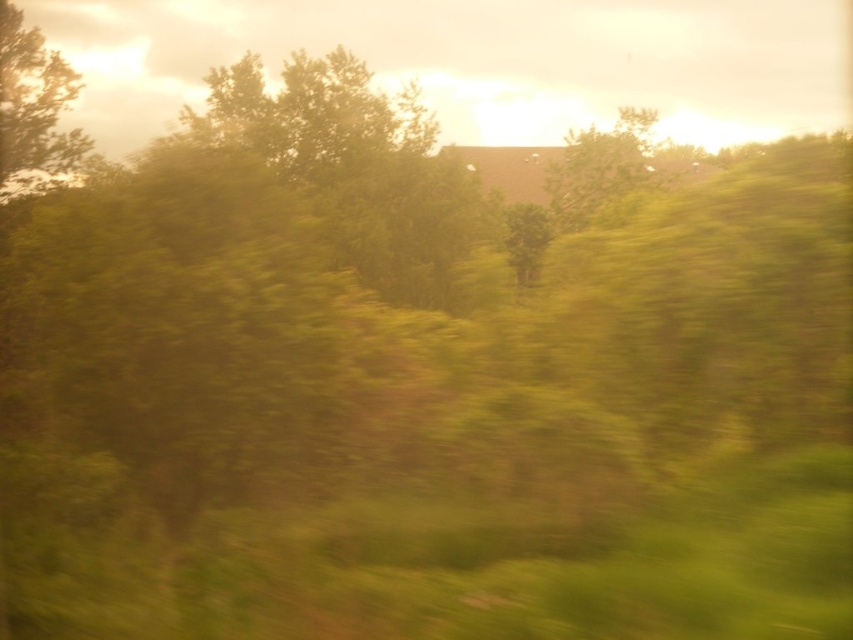
Does green leafy tree at upper left have a lesser height compared to green leafy tree at center?

Indeed, green leafy tree at upper left has a lesser height compared to green leafy tree at center.

Is point (38, 180) farther from camera compared to point (572, 160)?

No, it is in front of (572, 160).

Between point (6, 10) and point (610, 148), which one is positioned in front?

Positioned in front is point (6, 10).

The height and width of the screenshot is (640, 853). I want to click on green leafy tree at upper left, so (33, 109).